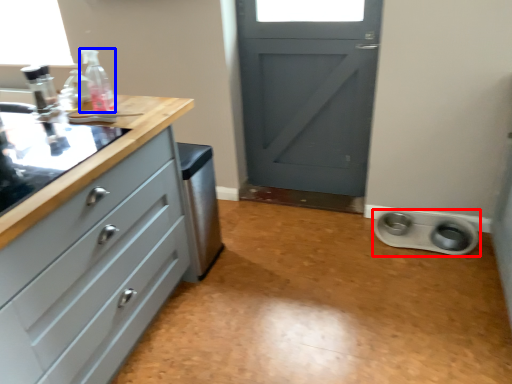
Question: Which of the following is the farthest to the observer, appliance (highlighted by a red box) or bottle (highlighted by a blue box)?

Choices:
 (A) appliance
 (B) bottle

Answer: (A)